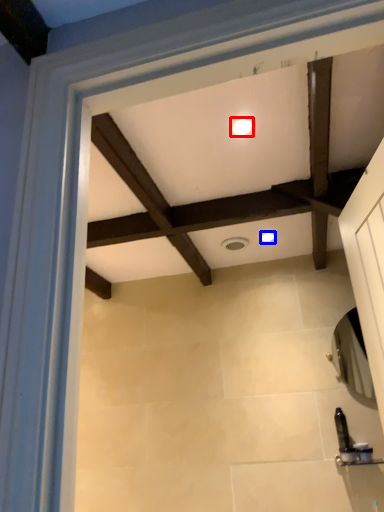
Question: Which point is further to the camera, lighting (highlighted by a red box) or lighting (highlighted by a blue box)?

Choices:
 (A) lighting
 (B) lighting

Answer: (B)